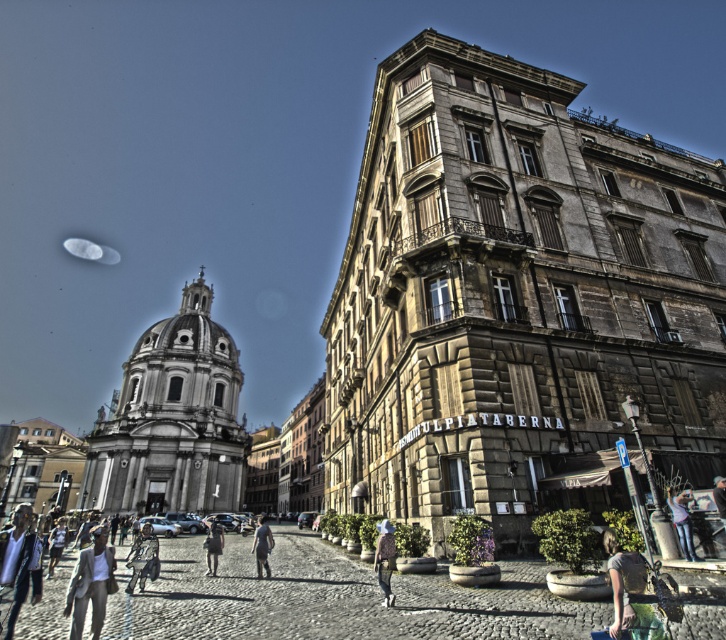
Question: Does denim jacket at lower right appear on the left side of dark gray fabric jacket at center?

Choices:
 (A) yes
 (B) no

Answer: (B)

Question: Is matte gray shirt at lower right closer to the viewer compared to light beige suit at lower left?

Choices:
 (A) no
 (B) yes

Answer: (B)

Question: Which of the following is the farthest from the observer?

Choices:
 (A) smooth stone plaza at center
 (B) light brown leather jacket at lower left
 (C) dark gray fabric jacket at lower right

Answer: (B)

Question: Which object appears closest to the camera in this image?

Choices:
 (A) denim jacket at lower center
 (B) matte gray shirt at lower right
 (C) light beige suit at lower left

Answer: (B)

Question: Considering the real-world distances, which object is farthest from the denim jacket at lower right?

Choices:
 (A) light beige suit at lower left
 (B) light gray fabric pants at center
 (C) light blue shirt at lower left
 (D) denim jacket at lower center

Answer: (C)

Question: Is denim jacket at lower center to the right of dark gray fabric jacket at center from the viewer's perspective?

Choices:
 (A) yes
 (B) no

Answer: (A)